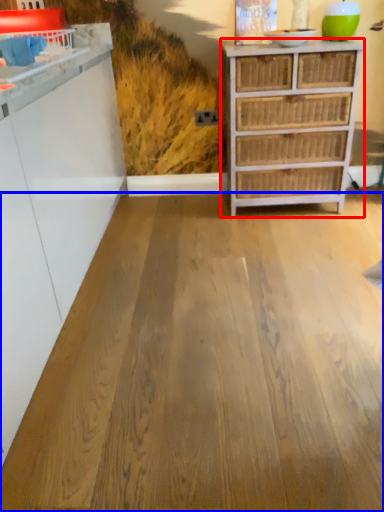
Question: Which point is closer to the camera, chest of drawers (highlighted by a red box) or plywood (highlighted by a blue box)?

Choices:
 (A) chest of drawers
 (B) plywood

Answer: (B)